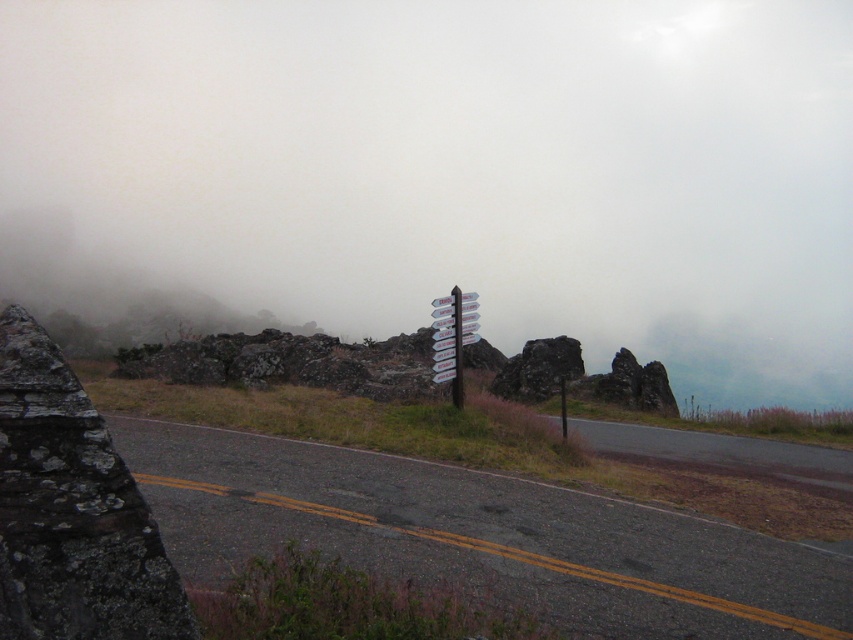
Between white plastic signpost at center and white plastic pole at center, which one is positioned lower?

white plastic signpost at center is below.

Who is more distant from viewer, (434, 340) or (453, 316)?

Point (453, 316)

Locate an element on the screen. white plastic signpost at center is located at coordinates (451, 337).

Is point (33, 442) positioned before point (474, 298)?

That is True.

Does lichen-covered rock at left have a greater width compared to white plastic signpost at center?

Indeed, lichen-covered rock at left has a greater width compared to white plastic signpost at center.

Is point (3, 481) closer to viewer compared to point (432, 380)?

Yes.

Identify the location of lichen-covered rock at left. Image resolution: width=853 pixels, height=640 pixels. (71, 509).

In the scene shown: Who is more forward, (16, 604) or (457, 320)?

Point (16, 604)

Which is behind, point (16, 589) or point (459, 365)?

The point (459, 365) is behind.

Is point (28, 572) behind point (460, 352)?

No, (28, 572) is in front of (460, 352).

At what (x,y) coordinates should I click in order to perform the action: click on lichen-covered rock at left. Please return your answer as a coordinate pair (x, y). Image resolution: width=853 pixels, height=640 pixels. Looking at the image, I should click on (71, 509).